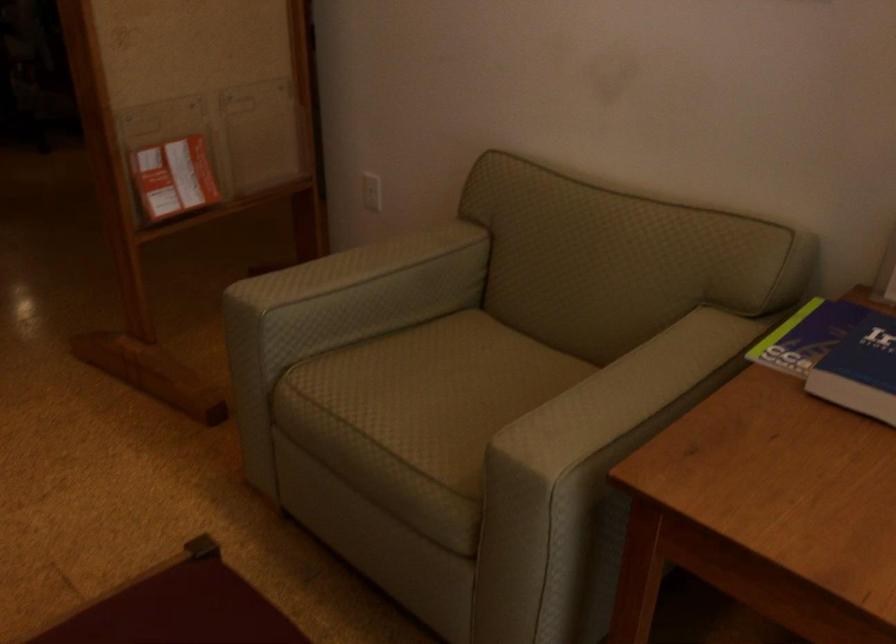
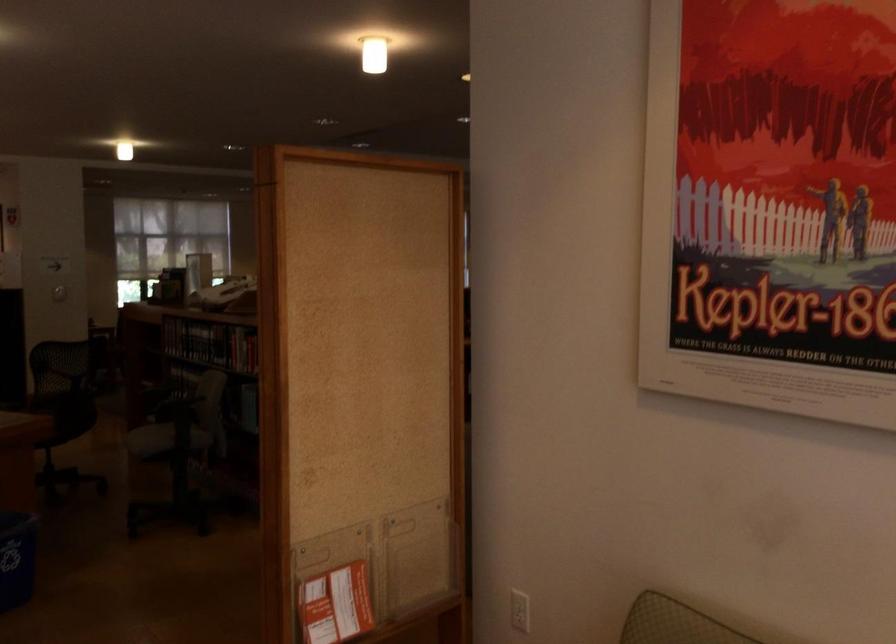
The point at (363, 194) is marked in the first image. Where is the corresponding point in the second image?

(520, 610)